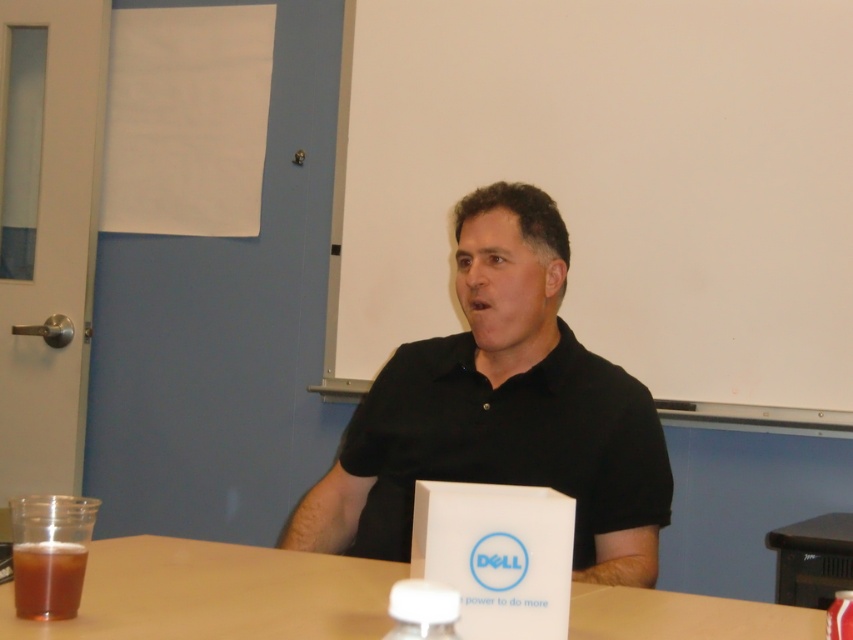
You are an interior designer assessing the room layout. The white matte board at upper center and the black matte shirt at center are both visible in the scene. Which object takes up more visual space in the image?

The white matte board at upper center takes up more visual space in the image as it is bigger than the black matte shirt at center.

In the scene shown: You are designing a layout for a product catalog. You need to place the black matte shirt at center and the brown translucent cup at lower left. Based on their sizes, which object should be placed closer to the edge of the page to ensure proper spacing?

The brown translucent cup at lower left should be placed closer to the edge of the page since it is narrower than the black matte shirt at center.